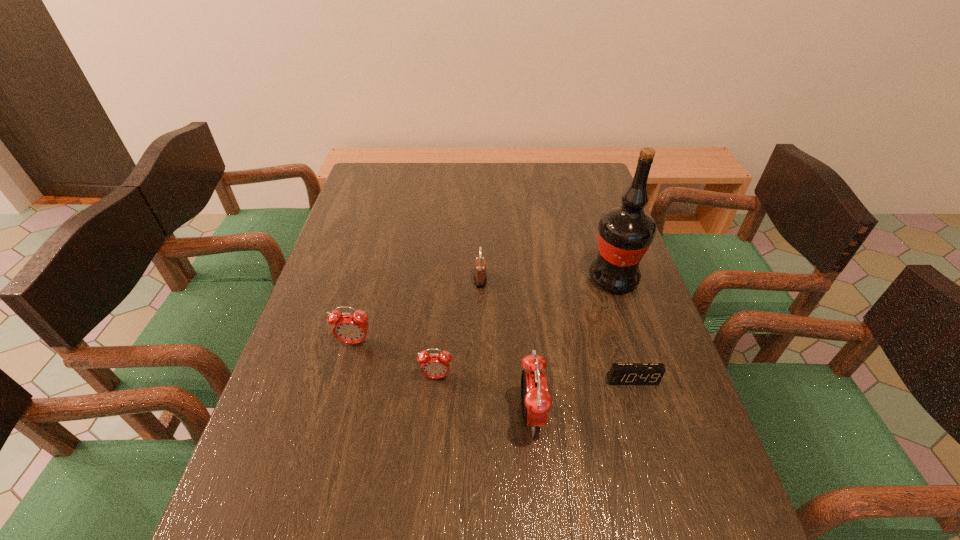
I want to click on vacant space at the near edge of the desktop, so click(492, 455).

At what (x,y) coordinates should I click in order to perform the action: click on vacant space at the left edge. Please return your answer as a coordinate pair (x, y). Looking at the image, I should click on (379, 231).

Locate an element on the screen. The height and width of the screenshot is (540, 960). free space at the right edge of the desktop is located at coordinates (688, 412).

Find the location of `vacant space at the far left corner`. vacant space at the far left corner is located at coordinates (377, 176).

This screenshot has height=540, width=960. In the image, there is a desktop. In order to click on vacant space at the near left corner in this screenshot , I will do `click(321, 496)`.

In the image, there is a desktop. Identify the location of vacant space at the near right corner. Image resolution: width=960 pixels, height=540 pixels. (717, 491).

Locate an element on the screen. free space that is in between the tallest object and the padlock is located at coordinates (547, 279).

I want to click on free space between the third tallest alarm clock and the third object from left to right, so 459,328.

Locate an element on the screen. vacant region between the third tallest alarm clock and the leftmost object is located at coordinates (396, 360).

This screenshot has height=540, width=960. Find the location of `free space between the farthest alarm clock and the padlock`. free space between the farthest alarm clock and the padlock is located at coordinates (418, 311).